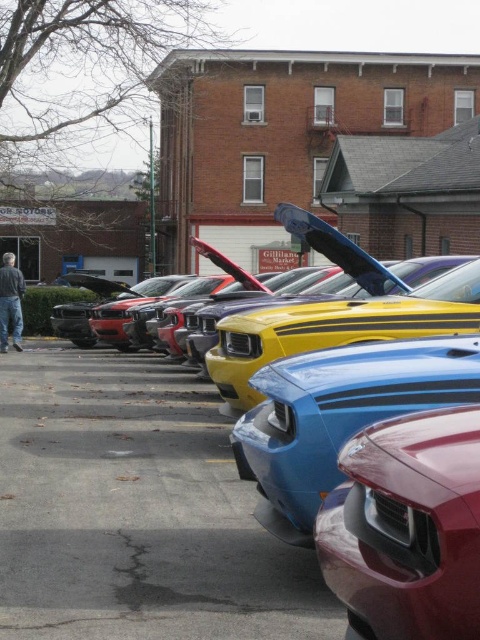
Question: Is yellow glossy car at center thinner than blue glossy car at center?

Choices:
 (A) no
 (B) yes

Answer: (A)

Question: Which object appears farthest from the camera in this image?

Choices:
 (A) blue glossy car at center
 (B) yellow glossy car at center

Answer: (B)

Question: Does yellow glossy car at center appear under blue glossy car at center?

Choices:
 (A) no
 (B) yes

Answer: (A)

Question: Which of these objects is positioned farthest from the yellow glossy car at center?

Choices:
 (A) glossy red car at center
 (B) blue glossy car at center

Answer: (A)

Question: Based on their relative distances, which object is farther from the blue glossy car at center?

Choices:
 (A) yellow glossy car at center
 (B) glossy red car at center

Answer: (B)

Question: Is yellow glossy car at center above blue glossy car at center?

Choices:
 (A) no
 (B) yes

Answer: (B)